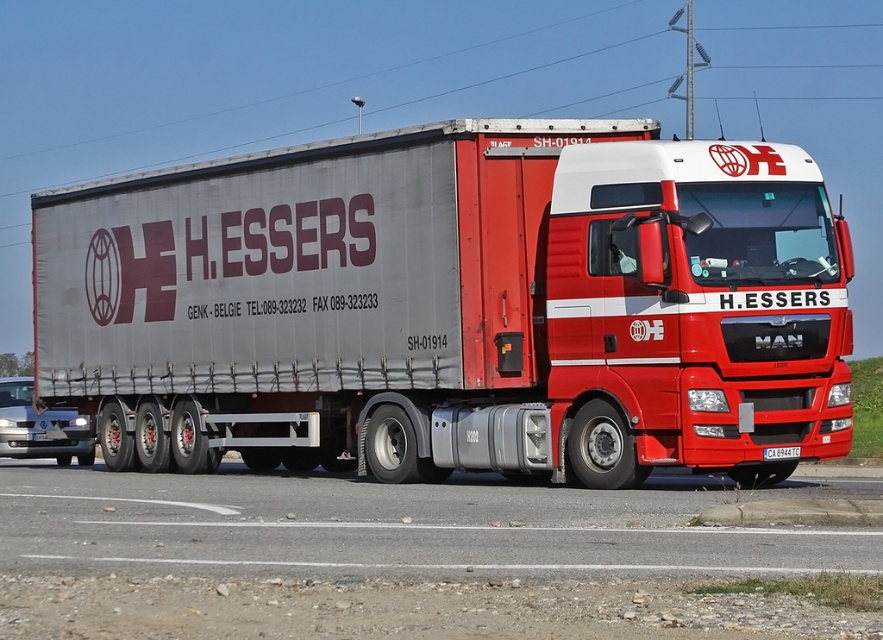
Question: Is metallic silver trailer truck at center behind black plastic license plate at center?

Choices:
 (A) no
 (B) yes

Answer: (A)

Question: Can you confirm if metallic wire at upper center is bigger than black plastic license plate at center?

Choices:
 (A) yes
 (B) no

Answer: (A)

Question: Can you confirm if metallic silver trailer truck at center is smaller than metallic wire at upper center?

Choices:
 (A) no
 (B) yes

Answer: (B)

Question: Which object appears closest to the camera in this image?

Choices:
 (A) metallic silver trailer truck at center
 (B) gray asphalt road at lower center
 (C) metallic wire at upper center
 (D) black plastic license plate at center

Answer: (B)

Question: Among these objects, which one is nearest to the camera?

Choices:
 (A) metallic wire at upper center
 (B) metallic silver trailer truck at center

Answer: (B)

Question: Which point is farther to the camera?

Choices:
 (A) gray asphalt road at lower center
 (B) metallic wire at upper center

Answer: (B)